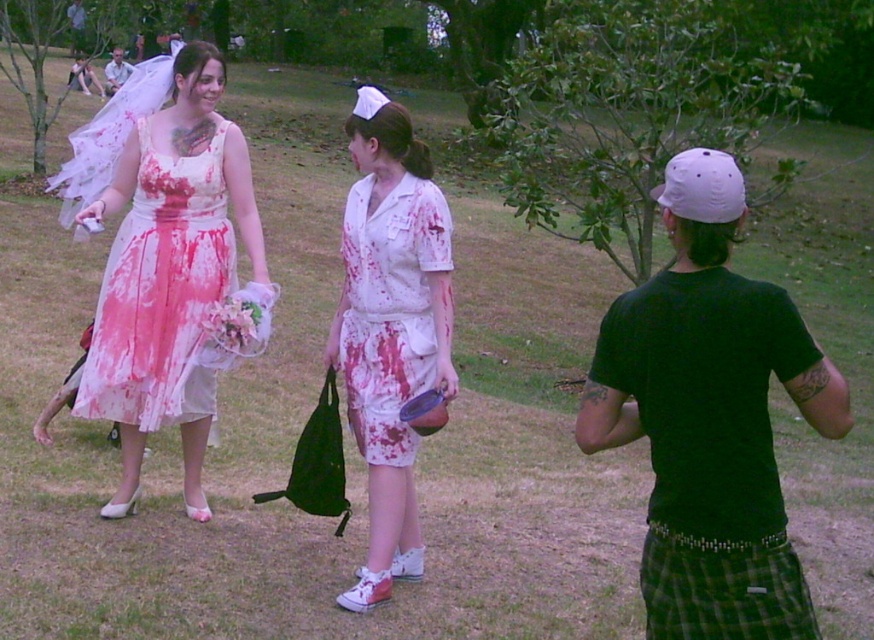
Question: Which object is the closest to the black cotton t-shirt at right?

Choices:
 (A) white satin dress at left
 (B) matte black shirt at center
 (C) white cotton nurse uniform at center

Answer: (C)

Question: Is white cotton nurse uniform at center thinner than white satin dress at left?

Choices:
 (A) yes
 (B) no

Answer: (A)

Question: Which of the following is the farthest from the observer?

Choices:
 (A) 777,483
 (B) 664,556

Answer: (B)

Question: Is black cotton t-shirt at right smaller than white satin dress at left?

Choices:
 (A) yes
 (B) no

Answer: (B)

Question: Does white cotton nurse uniform at center lie in front of blood-stained fabric dress at center?

Choices:
 (A) yes
 (B) no

Answer: (A)

Question: Which of the following is the farthest from the observer?

Choices:
 (A) (657, 342)
 (B) (737, 616)
 (C) (344, 348)

Answer: (C)